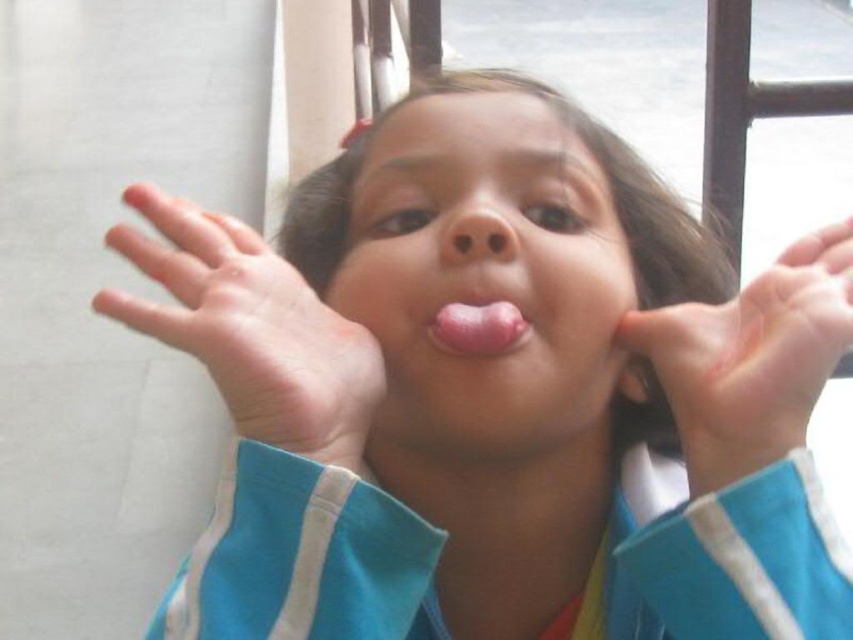
You are a photographer trying to capture the perfect shot of the child. You notice two points in the scene labeled as point (173, 212) and point (490, 314). Which point should you focus on to ensure the child is in focus, considering their position relative to these points?

Point (490, 314) should be focused on because it is in front of point (173, 212), meaning the child is closer to this point and thus in focus.

The child is trying to touch their nose with their hand. Based on the image, is the pale skin hand at center able to reach the pink matte nose at center?

Yes, the pale skin hand at center is in front of the pink matte nose at center, indicating that it can reach it.